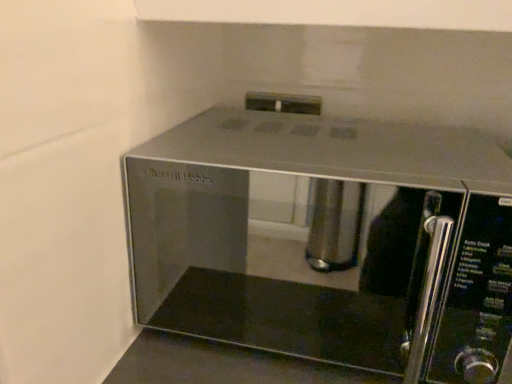
At what (x,y) coordinates should I click in order to perform the action: click on free space above satin silver microwave at center (from a real-world perspective). Please return your answer as a coordinate pair (x, y). Image resolution: width=512 pixels, height=384 pixels. Looking at the image, I should click on (321, 136).